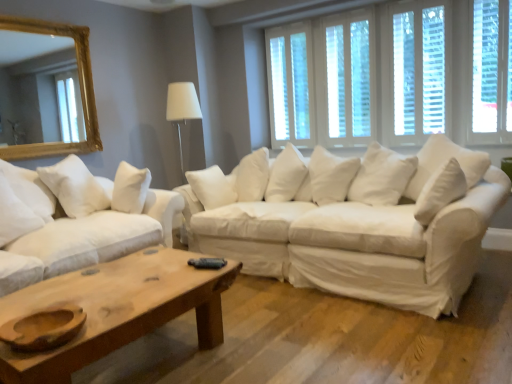
Question: From a real-world perspective, is white wood window at upper center, positioned as the 3th window in right-to-left order, positioned above or below white wood window at upper center, the fourth window when ordered from right to left?

Choices:
 (A) below
 (B) above

Answer: (A)

Question: In terms of width, does white wood window at upper center, positioned as the 2th window in left-to-right order, look wider or thinner when compared to white wood window at upper center, the fourth window when ordered from right to left?

Choices:
 (A) wide
 (B) thin

Answer: (A)

Question: Estimate the real-world distances between objects in this image. Which object is closer to the white wooden blinds at upper right, arranged as the second window when viewed from the right?

Choices:
 (A) white fabric couch at center, marked as the 2th studio couch in a left-to-right arrangement
 (B) white wood window at upper center, the fourth window when ordered from right to left
 (C) white cotton couch at center, marked as the 1th studio couch in a left-to-right arrangement
 (D) white wood window at upper right, the first window in the right-to-left sequence
 (E) gold-framed mirror at upper left

Answer: (D)

Question: Estimate the real-world distances between objects in this image. Which object is farther from the white wooden blinds at upper right, the 3th window from the left?

Choices:
 (A) white soft pillow at left
 (B) white wood window at upper center, positioned as the 3th window in right-to-left order
 (C) white wood window at upper center, the fourth window when ordered from right to left
 (D) white fabric couch at center, arranged as the first studio couch when viewed from the right
 (E) wooden coffee table at lower center

Answer: (E)